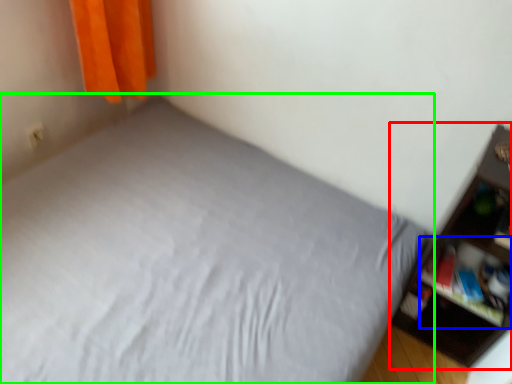
Question: Estimate the real-world distances between objects in this image. Which object is farther from shelf (highlighted by a red box), cabinet (highlighted by a blue box) or bed (highlighted by a green box)?

Choices:
 (A) cabinet
 (B) bed

Answer: (B)